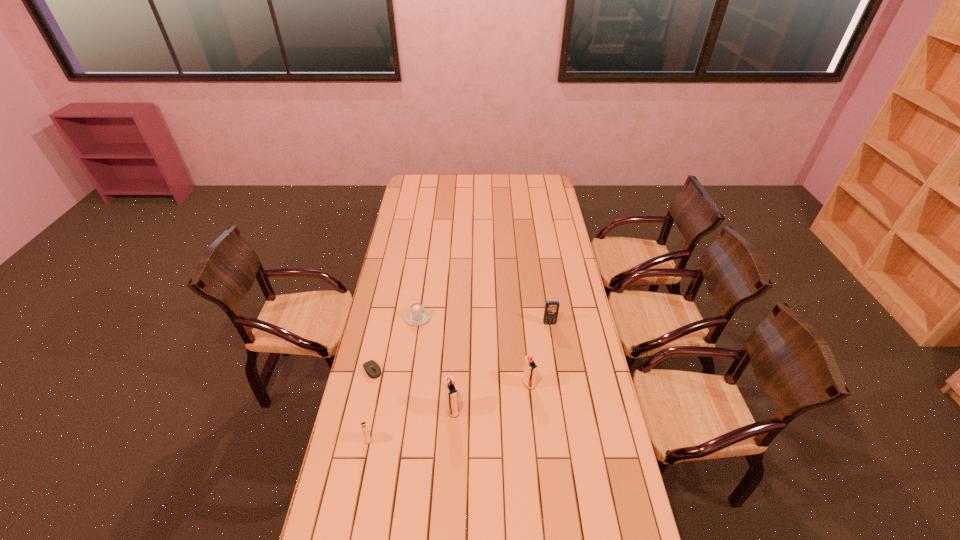
Identify the location of free space for a new igniter on the right. (597, 360).